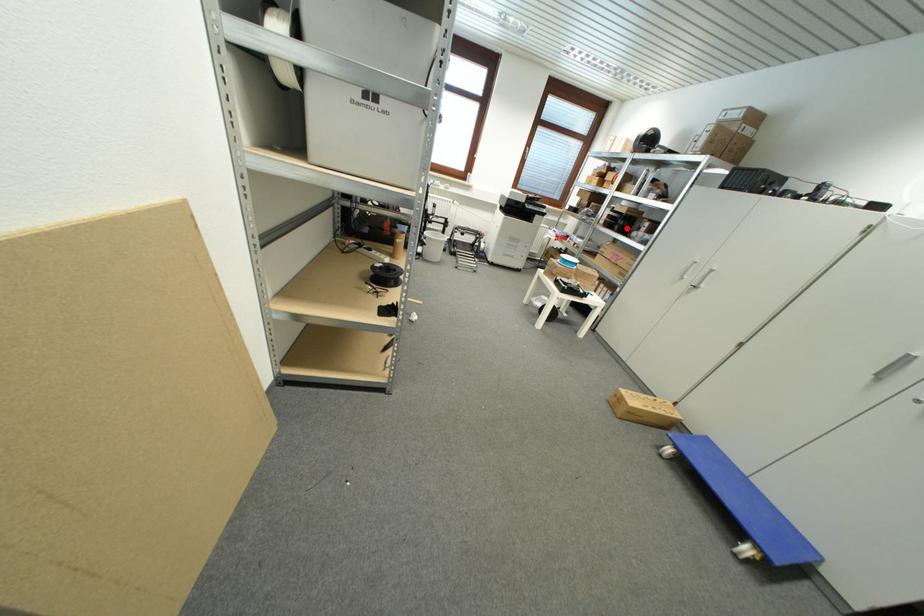
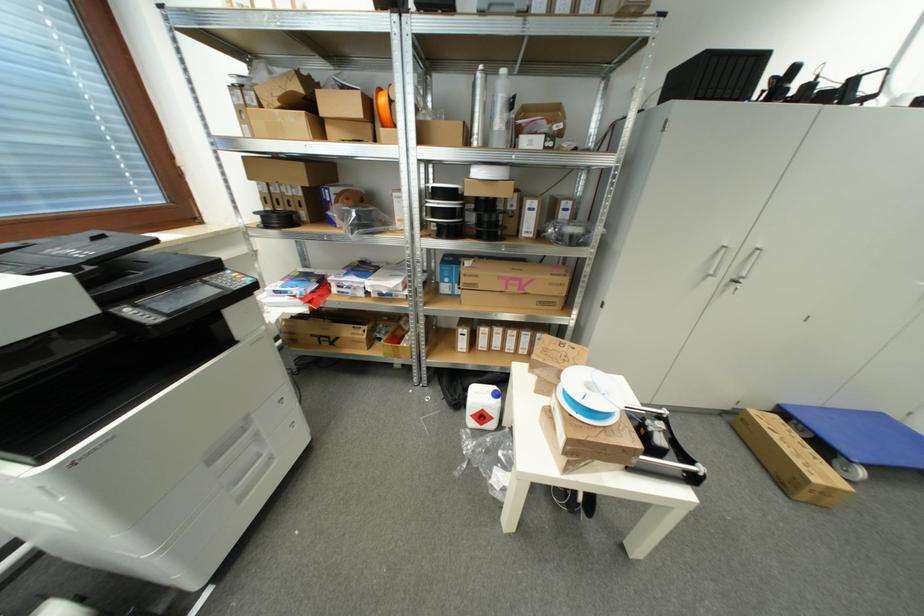
Locate, in the second image, the point that corresponds to the highlighted location in the first image.

(493, 225)